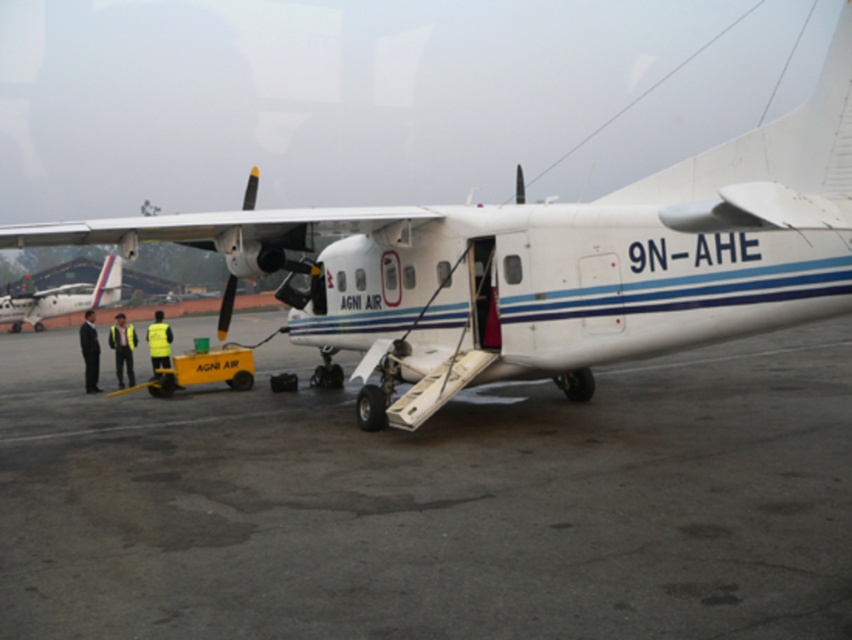
You are standing at the point marked as point (330,317). You want to walk directly towards the aircraft. How far will you have to walk to reach the aircraft?

The distance of point (330,317) from viewer is 38.31 feet, so you will have to walk 38.31 feet to reach the aircraft.

You are a passenger who just boarded the aircraft and need to locate the nearest emergency exit. You see the gray asphalt tarmac at center and the yellow reflective vest at center. Which object is positioned to the right of the other?

The gray asphalt tarmac at center is to the right of the yellow reflective vest at center.

You are standing at the point closest to the aircraft door. Which of the two points, point (75,369) or point (158,317), is farther away from you?

Point (75,369) is behind point (158,317), so if you are standing at the point closest to the aircraft door, point (75,369) is farther away from you.